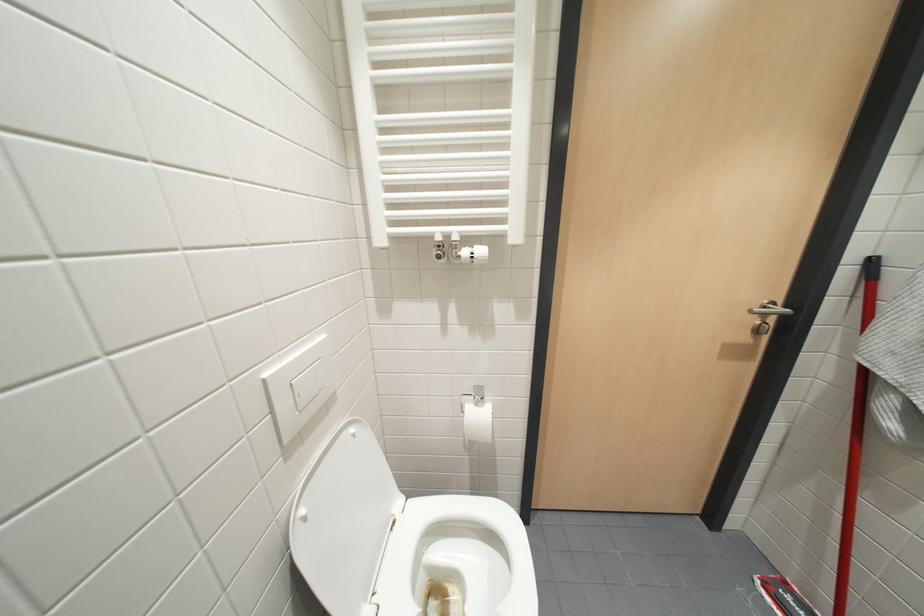
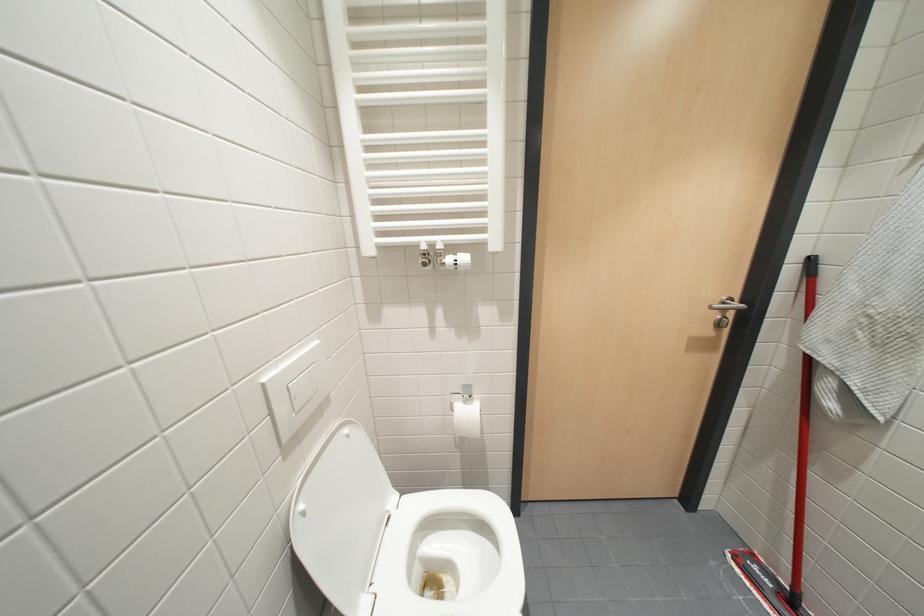
In a continuous first-person perspective shot, in which direction is the camera moving?

The movement direction of the cameraman is right, backward.